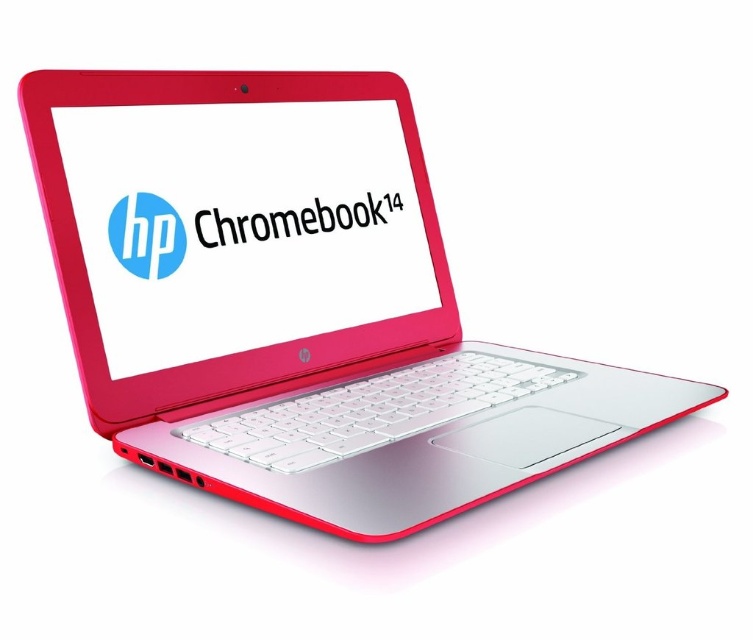
You are setting up a display for a tech fair and want to arrange the matte plastic screen at center and the matte plastic logo at center side by side. Which object should you place first to ensure they fit properly?

The matte plastic screen at center has a greater width than the matte plastic logo at center. Therefore, you should place the wider matte plastic screen at center first to ensure there is enough space for both objects side by side.

You are a technician trying to align two stickers on the HP Chromebook 14 laptop. You have a sticker for the screen and a sticker for the logo. The stickers must be placed precisely. Given the distance between the matte plastic screen at center and the matte plastic logo at center, can you determine if the stickers will fit without overlapping?

The distance between the matte plastic screen at center and the matte plastic logo at center is 3.36 inches. If the combined width of both stickers is less than or equal to 3.36 inches, they can be placed without overlapping. However, if the stickers are wider than this distance, they will overlap.